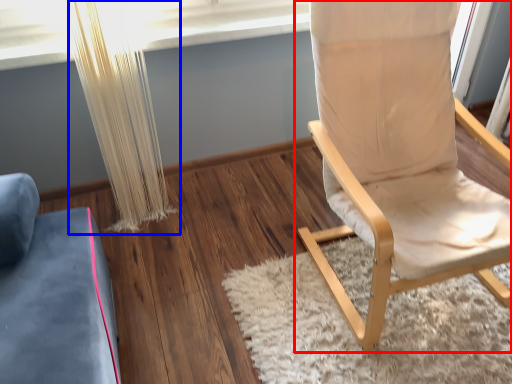
Question: Which object is further to the camera taking this photo, chair (highlighted by a red box) or curtain (highlighted by a blue box)?

Choices:
 (A) chair
 (B) curtain

Answer: (B)